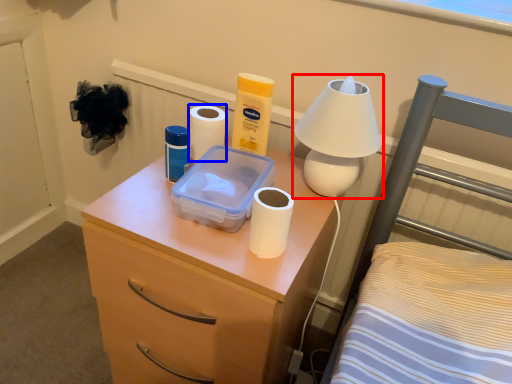
Question: Which point is closer to the camera, lamp (highlighted by a red box) or toilet paper (highlighted by a blue box)?

Choices:
 (A) lamp
 (B) toilet paper

Answer: (A)